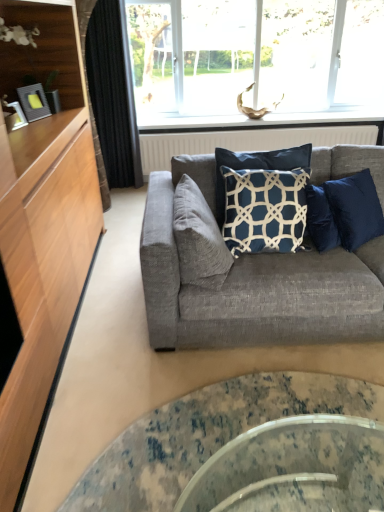
The width and height of the screenshot is (384, 512). What do you see at coordinates (246, 141) in the screenshot? I see `white textured radiator at upper center` at bounding box center [246, 141].

Find the location of a particular element. This screenshot has height=512, width=384. white textured radiator at upper center is located at coordinates (246, 141).

The height and width of the screenshot is (512, 384). Identify the location of transparent glass window at upper center. (256, 59).

What is the approximate height of transparent glass window at upper center?

The height of transparent glass window at upper center is 3.47 feet.

The image size is (384, 512). I want to click on black fabric curtain at left, so click(x=113, y=95).

Where is `white textured radiator at upper center`? white textured radiator at upper center is located at coordinates (246, 141).

Is textured gray couch at center inside or outside of suede gray pillow at center, placed as the second pillow when sorted from right to left?

textured gray couch at center is spatially situated outside suede gray pillow at center, placed as the second pillow when sorted from right to left.

From the image's perspective, which one is positioned higher, textured gray couch at center or suede gray pillow at center, placed as the second pillow when sorted from right to left?

suede gray pillow at center, placed as the second pillow when sorted from right to left, appears higher in the image.

Measure the distance from textured gray couch at center to suede gray pillow at center, the 1th pillow in the left-to-right sequence.

They are 8.23 inches apart.

Could you measure the distance between textured gray couch at center and navy blue fabric pillow at center, marked as the first pillow in a right-to-left arrangement?

They are 41.25 centimeters apart.

Is textured gray couch at center not close to navy blue fabric pillow at center, which appears as the second pillow when viewed from the left?

No, textured gray couch at center is not far away from navy blue fabric pillow at center, which appears as the second pillow when viewed from the left.

Identify the location of the 1st pillow positioned above the textured gray couch at center (from a real-world perspective). The image size is (384, 512). (355, 209).

From the image's perspective, count 1st pillows downward from the white textured radiator at upper center and point to it. Please provide its 2D coordinates.

[(355, 209)]

How many degrees apart are the facing directions of navy blue fabric pillow at center, which appears as the second pillow when viewed from the left, and white textured radiator at upper center?

The angular difference between navy blue fabric pillow at center, which appears as the second pillow when viewed from the left, and white textured radiator at upper center is 38.7 degrees.

Considering their positions, is navy blue fabric pillow at center, marked as the first pillow in a right-to-left arrangement, located in front of or behind white textured radiator at upper center?

navy blue fabric pillow at center, marked as the first pillow in a right-to-left arrangement, is in front of white textured radiator at upper center.

From a real-world perspective, is navy blue fabric pillow at center, which appears as the second pillow when viewed from the left, positioned above or below white textured radiator at upper center?

In terms of real-world spatial position, navy blue fabric pillow at center, which appears as the second pillow when viewed from the left, is above white textured radiator at upper center.

Which is farther from the camera, (157, 426) or (220, 279)?

Positioned behind is point (220, 279).

Could you measure the distance between clear glass coffee table at center and suede gray pillow at center, placed as the second pillow when sorted from right to left?

The distance of clear glass coffee table at center from suede gray pillow at center, placed as the second pillow when sorted from right to left, is 68.40 centimeters.

Is clear glass coffee table at center inside or outside of suede gray pillow at center, placed as the second pillow when sorted from right to left?

clear glass coffee table at center exists outside the volume of suede gray pillow at center, placed as the second pillow when sorted from right to left.

From a real-world perspective, which object stands above the other?

suede gray pillow at center, placed as the second pillow when sorted from right to left, from a real-world perspective.

Considering the relative positions of transparent glass window at upper center and navy blue fabric pillow at center, which appears as the second pillow when viewed from the left, in the image provided, is transparent glass window at upper center in front of navy blue fabric pillow at center, which appears as the second pillow when viewed from the left,?

No, the depth of transparent glass window at upper center is greater than that of navy blue fabric pillow at center, which appears as the second pillow when viewed from the left.

Considering the sizes of objects transparent glass window at upper center and navy blue fabric pillow at center, marked as the first pillow in a right-to-left arrangement, in the image provided, who is shorter, transparent glass window at upper center or navy blue fabric pillow at center, marked as the first pillow in a right-to-left arrangement,?

With less height is navy blue fabric pillow at center, marked as the first pillow in a right-to-left arrangement.

This screenshot has width=384, height=512. Find the location of `pillow that appears on the right of transparent glass window at upper center`. pillow that appears on the right of transparent glass window at upper center is located at coordinates (355, 209).

What's the angular difference between transparent glass window at upper center and navy blue fabric pillow at center, marked as the first pillow in a right-to-left arrangement,'s facing directions?

The angular difference between transparent glass window at upper center and navy blue fabric pillow at center, marked as the first pillow in a right-to-left arrangement, is 38.6 degrees.

Does white textured radiator at upper center have a lesser width compared to suede gray pillow at center, placed as the second pillow when sorted from right to left?

Yes.

Are white textured radiator at upper center and suede gray pillow at center, the 1th pillow in the left-to-right sequence, making contact?

white textured radiator at upper center and suede gray pillow at center, the 1th pillow in the left-to-right sequence, are not in contact.

The width and height of the screenshot is (384, 512). In order to click on radiator that is behind the suede gray pillow at center, the 1th pillow in the left-to-right sequence in this screenshot , I will do `click(246, 141)`.

Looking at this image, considering the sizes of white textured radiator at upper center and suede gray pillow at center, the 1th pillow in the left-to-right sequence, in the image, is white textured radiator at upper center taller or shorter than suede gray pillow at center, the 1th pillow in the left-to-right sequence,?

Clearly, white textured radiator at upper center is taller compared to suede gray pillow at center, the 1th pillow in the left-to-right sequence.

Could you tell me if transparent glass window at upper center is turned towards textured gray couch at center?

Yes, transparent glass window at upper center is facing textured gray couch at center.

Would you say transparent glass window at upper center is a long distance from textured gray couch at center?

Absolutely, transparent glass window at upper center is distant from textured gray couch at center.

The height and width of the screenshot is (512, 384). Find the location of `studio couch that appears in front of the suede gray pillow at center, the 1th pillow in the left-to-right sequence`. studio couch that appears in front of the suede gray pillow at center, the 1th pillow in the left-to-right sequence is located at coordinates (253, 284).

From a real-world perspective, starting from the textured gray couch at center, which pillow is the 1st one vertically above it? Please provide its 2D coordinates.

[(355, 209)]

Looking at the image, which one is located closer to white textured radiator at upper center, clear glass coffee table at center or suede gray pillow at center, the 1th pillow in the left-to-right sequence?

suede gray pillow at center, the 1th pillow in the left-to-right sequence, is positioned closer to the anchor white textured radiator at upper center.

When comparing their distances from white textured radiator at upper center, does suede gray pillow at center, the 1th pillow in the left-to-right sequence, or navy blue fabric pillow at center, marked as the first pillow in a right-to-left arrangement, seem closer?

navy blue fabric pillow at center, marked as the first pillow in a right-to-left arrangement.

Considering their positions, is black fabric curtain at left positioned closer to white textured radiator at upper center than transparent glass window at upper center?

black fabric curtain at left lies closer to white textured radiator at upper center than the other object.

From the image, which object appears to be nearer to transparent glass window at upper center, white textured radiator at upper center or black fabric curtain at left?

black fabric curtain at left is closer to transparent glass window at upper center.

Which object lies nearer to the anchor point black fabric curtain at left, white textured radiator at upper center or textured gray couch at center?

white textured radiator at upper center is closer to black fabric curtain at left.

When comparing their distances from clear glass coffee table at center, does navy blue fabric pillow at center, marked as the first pillow in a right-to-left arrangement, or suede gray pillow at center, the 1th pillow in the left-to-right sequence, seem closer?

Among the two, suede gray pillow at center, the 1th pillow in the left-to-right sequence, is located nearer to clear glass coffee table at center.

Looking at the image, which one is located further to textured gray couch at center, suede gray pillow at center, the 1th pillow in the left-to-right sequence, or transparent glass window at upper center?

Among the two, transparent glass window at upper center is located further to textured gray couch at center.

Considering their positions, is transparent glass window at upper center positioned further to suede gray pillow at center, the 1th pillow in the left-to-right sequence, than white textured radiator at upper center?

Among the two, transparent glass window at upper center is located further to suede gray pillow at center, the 1th pillow in the left-to-right sequence.

Locate an element on the screen. Image resolution: width=384 pixels, height=512 pixels. studio couch between clear glass coffee table at center and black fabric curtain at left in the front-back direction is located at coordinates (253, 284).

Where is `pillow positioned between suede gray pillow at center, placed as the second pillow when sorted from right to left, and black fabric curtain at left from near to far`? The width and height of the screenshot is (384, 512). pillow positioned between suede gray pillow at center, placed as the second pillow when sorted from right to left, and black fabric curtain at left from near to far is located at coordinates (355, 209).

You are a GUI agent. You are given a task and a screenshot of the screen. Output one action in this format:
    pyautogui.click(x=<x>, y=<y>)
    Task: Click on the studio couch between transparent glass window at upper center and clear glass coffee table at center in the vertical direction
    Image resolution: width=384 pixels, height=512 pixels.
    Given the screenshot: What is the action you would take?
    pyautogui.click(x=253, y=284)

The width and height of the screenshot is (384, 512). Find the location of `radiator located between black fabric curtain at left and transparent glass window at upper center in the left-right direction`. radiator located between black fabric curtain at left and transparent glass window at upper center in the left-right direction is located at coordinates (246, 141).